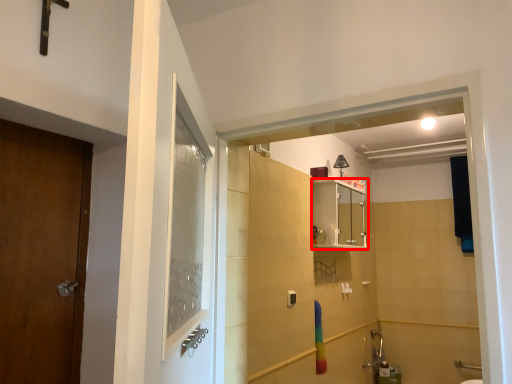
Question: Considering the relative positions of cabinetry (annotated by the red box) and light fixture in the image provided, where is cabinetry (annotated by the red box) located with respect to the staircase?

Choices:
 (A) left
 (B) right

Answer: (A)